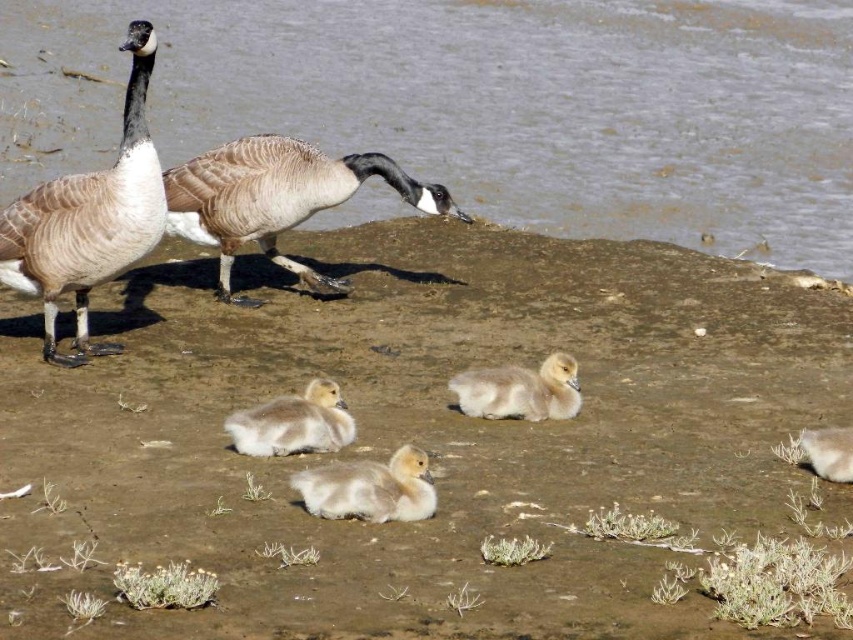
You are a wildlife photographer aiming to capture a closeup shot of the brown feathered goose at center and the white fluffy duckling at lower right. Given that your camera lens has a maximum focus range of 1 meter, can you determine which subject is within the focus range?

The brown feathered goose at center is wider than the white fluffy duckling at lower right, but the question about focus range requires information about distance, not width. Since the scene description does not provide specific distance measurements between the photographer and the subjects, it is impossible to determine if they are within the 1 meter focus range based on the given information.

You are a photographer aiming to capture a photo of the brown sandy ground at center and the brown feathered goose at left. Based on their sizes, which one should you focus on to ensure it takes up more space in your camera frame?

The brown sandy ground at center is wider than the brown feathered goose at left, so focusing on the brown sandy ground at center will ensure it occupies more space in the photo.